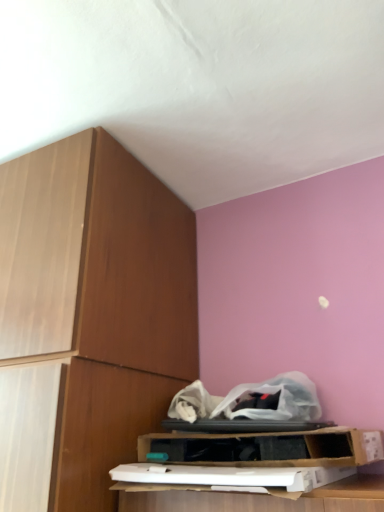
What is the approximate width of wooden cabinet at left?

wooden cabinet at left is 25.63 inches wide.

This screenshot has height=512, width=384. Identify the location of wooden cabinet at left. pos(88,318).

The image size is (384, 512). What do you see at coordinates (88, 318) in the screenshot? I see `wooden cabinet at left` at bounding box center [88, 318].

Describe the element at coordinates (260, 447) in the screenshot. Image resolution: width=384 pixels, height=512 pixels. I see `cardboard box at lower center` at that location.

Locate an element on the screen. This screenshot has height=512, width=384. cardboard box at lower center is located at coordinates (260, 447).

The height and width of the screenshot is (512, 384). Identify the location of wooden cabinet at left. (88, 318).

Is cardboard box at lower center to the right of wooden cabinet at left from the viewer's perspective?

Indeed, cardboard box at lower center is positioned on the right side of wooden cabinet at left.

Which object is further away from the camera taking this photo, cardboard box at lower center or wooden cabinet at left?

cardboard box at lower center is further away from the camera.

Which is in front, point (356, 451) or point (34, 406)?

Positioned in front is point (356, 451).

From the image's perspective, between cardboard box at lower center and wooden cabinet at left, who is located below?

cardboard box at lower center is shown below in the image.

From a real-world perspective, which is physically above, cardboard box at lower center or wooden cabinet at left?

wooden cabinet at left is physically above.

Considering the sizes of objects cardboard box at lower center and wooden cabinet at left in the image provided, who is wider, cardboard box at lower center or wooden cabinet at left?

wooden cabinet at left is wider.

Does cardboard box at lower center have a lesser height compared to wooden cabinet at left?

Indeed, cardboard box at lower center has a lesser height compared to wooden cabinet at left.

Is cardboard box at lower center bigger or smaller than wooden cabinet at left?

In the image, cardboard box at lower center appears to be smaller than wooden cabinet at left.

Is cardboard box at lower center not within wooden cabinet at left?

Yes, cardboard box at lower center is not within wooden cabinet at left.

Is cardboard box at lower center placed right next to wooden cabinet at left?

No, cardboard box at lower center is not next to wooden cabinet at left.

Based on the photo, could you tell me if cardboard box at lower center is turned towards wooden cabinet at left?

No, cardboard box at lower center is not oriented towards wooden cabinet at left.

How different are the orientations of cardboard box at lower center and wooden cabinet at left in degrees?

The facing directions of cardboard box at lower center and wooden cabinet at left are 0.522 degrees apart.

At what (x,y) coordinates should I click in order to perform the action: click on shelf that appears below the wooden cabinet at left (from a real-world perspective). Please return your answer as a coordinate pair (x, y). The image size is (384, 512). Looking at the image, I should click on (260, 447).

Considering the relative positions of wooden cabinet at left and cardboard box at lower center in the image provided, is wooden cabinet at left to the left of cardboard box at lower center from the viewer's perspective?

Indeed, wooden cabinet at left is positioned on the left side of cardboard box at lower center.

Does wooden cabinet at left lie behind cardboard box at lower center?

That is False.

Looking at this image, which is farther, (142, 225) or (212, 452)?

Positioned behind is point (142, 225).

From the image's perspective, is wooden cabinet at left above or below cardboard box at lower center?

Based on their image positions, wooden cabinet at left is located above cardboard box at lower center.

From a real-world perspective, is wooden cabinet at left on top of cardboard box at lower center?

Yes.

Can you confirm if wooden cabinet at left is wider than cardboard box at lower center?

Correct, the width of wooden cabinet at left exceeds that of cardboard box at lower center.

Is wooden cabinet at left shorter than cardboard box at lower center?

In fact, wooden cabinet at left may be taller than cardboard box at lower center.

Who is bigger, wooden cabinet at left or cardboard box at lower center?

wooden cabinet at left is bigger.

Do you think wooden cabinet at left is within cardboard box at lower center, or outside of it?

wooden cabinet at left is not enclosed by cardboard box at lower center.

Is wooden cabinet at left next to cardboard box at lower center and touching it?

No, wooden cabinet at left is not in contact with cardboard box at lower center.

Is wooden cabinet at left turned away from cardboard box at lower center?

No.

How many degrees apart are the facing directions of wooden cabinet at left and cardboard box at lower center?

0.522 degrees.

The height and width of the screenshot is (512, 384). I want to click on shelf below the wooden cabinet at left (from the image's perspective), so click(260, 447).

Where is `cabinetry on the left side of cardboard box at lower center`? This screenshot has width=384, height=512. cabinetry on the left side of cardboard box at lower center is located at coordinates (88, 318).

At what (x,y) coordinates should I click in order to perform the action: click on shelf on the right of wooden cabinet at left. Please return your answer as a coordinate pair (x, y). The height and width of the screenshot is (512, 384). Looking at the image, I should click on (260, 447).